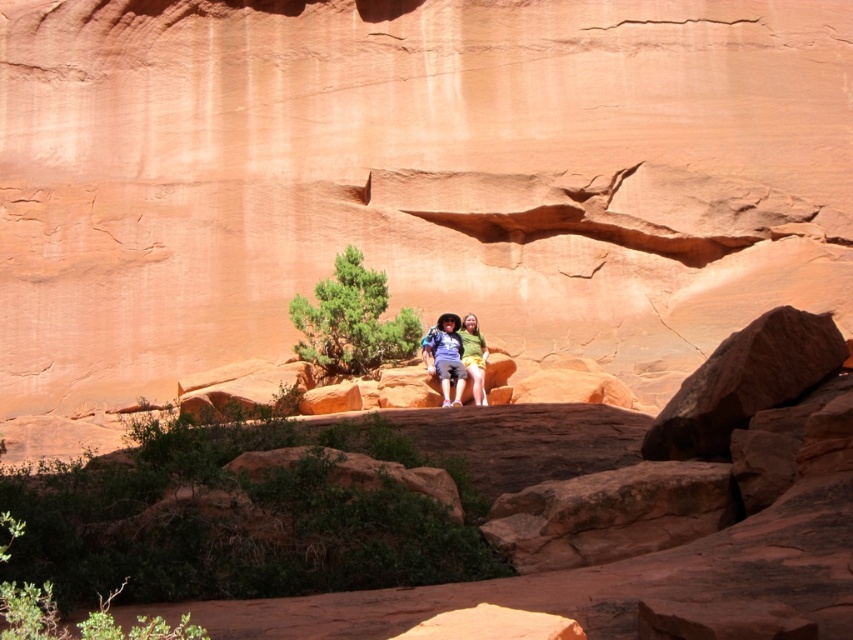
You are standing in the desert scene and notice the matte blue shorts at center. Based on their position, can you determine if they are closer to the foreground rocky outcrop or the large red rock formation in the background?

The matte blue shorts at center is located at point (445, 356), which places it closer to the foreground rocky outcrop than the large red rock formation in the background.

In the scene shown: You are a photographer planning to take a photo of the desert landscape. You notice two people wearing matte blue shorts at center and matte green shorts at center. Which person would you position closer to the large, reddish brown rock formation to ensure they are partially obscured by the rock formation?

The matte blue shorts at center has a lesser height compared to matte green shorts at center. To partially obscure them with the rock formation, position the shorter person, matte blue shorts at center, closer to the rock formation since their smaller stature would be more easily obscured by the rock.